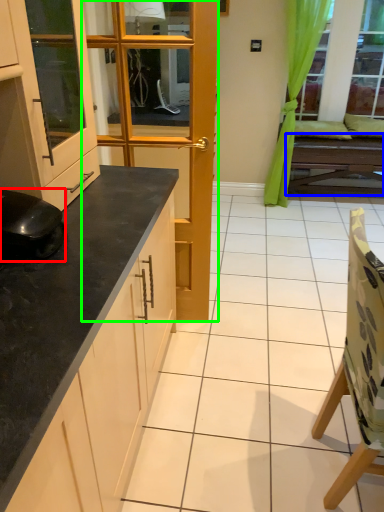
Question: Which object is positioned farthest from appliance (highlighted by a red box)? Select from table (highlighted by a blue box) and door (highlighted by a green box).

Choices:
 (A) table
 (B) door

Answer: (A)